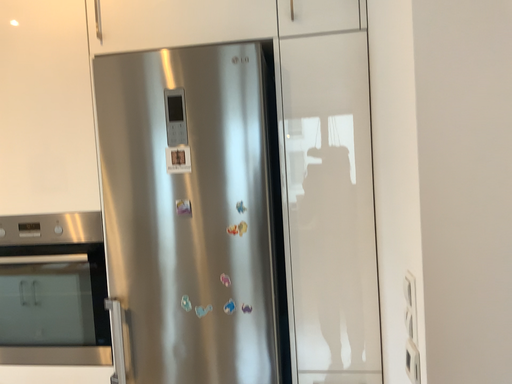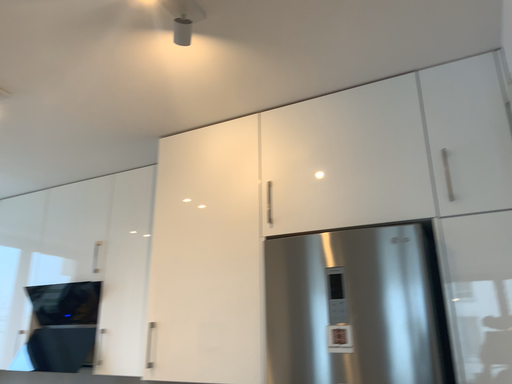
Question: How did the camera likely rotate when shooting the video?

Choices:
 (A) rotated left
 (B) rotated right

Answer: (A)